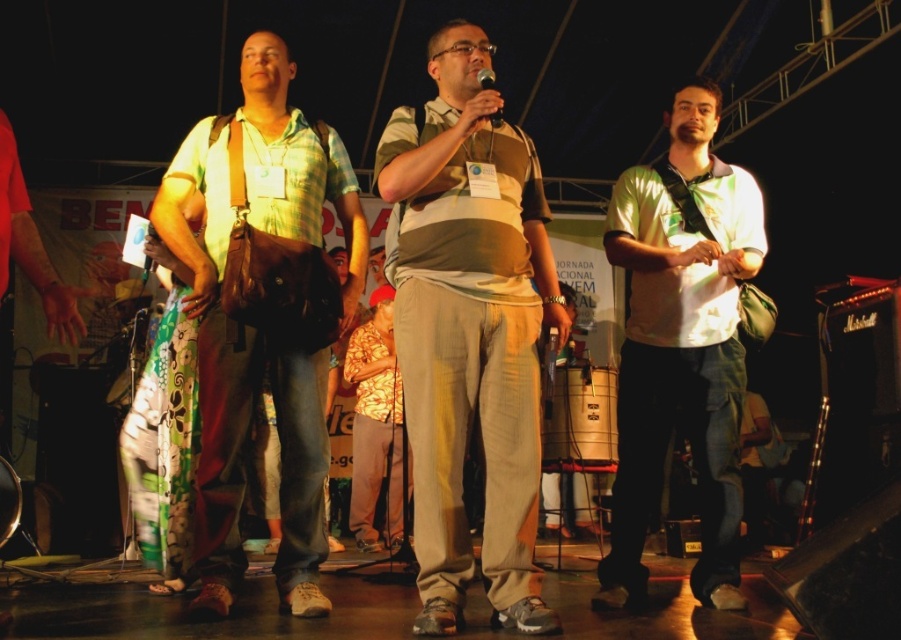
You are a photographer positioned at the camera. You want to capture a closeup shot of the light green fabric shirt at center. Given that your camera can focus on subjects within 2 meters, can you achieve this without moving closer?

The light green fabric shirt at center is 3.06 meters away from the camera. Since the camera can only focus within 2 meters, you cannot capture a closeup without moving closer.

You are an event organizer checking the stage setup. You need to ensure that the light green fabric shirt at center and the matte black microphone at center are positioned so that the microphone is clearly visible to the audience. Given their widths, which object should be placed closer to the front to ensure visibility?

The light green fabric shirt at center is wider than the matte black microphone at center. To ensure the microphone is clearly visible, the matte black microphone at center should be placed closer to the front since it is narrower and less likely to be obscured by the wider shirt.